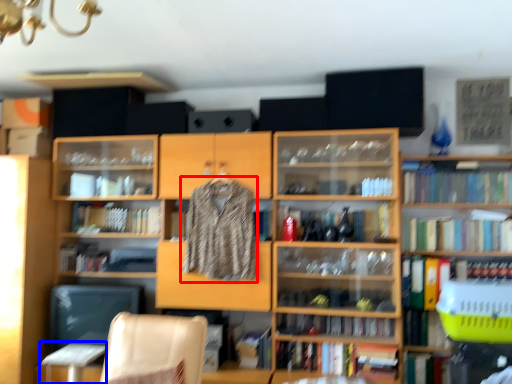
Question: Which object is closer to the camera taking this photo, clothing (highlighted by a red box) or table (highlighted by a blue box)?

Choices:
 (A) clothing
 (B) table

Answer: (B)